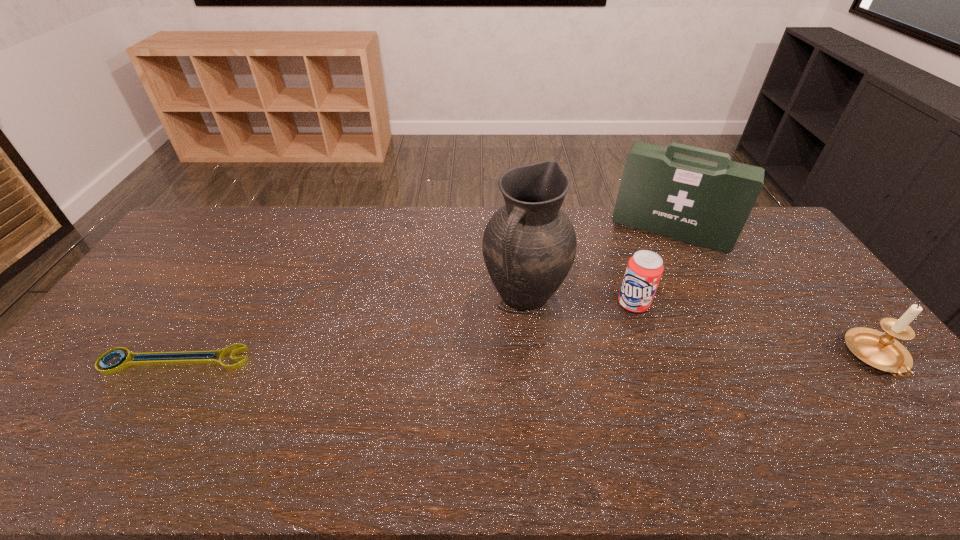
Where is `vacant spot on the desktop that is between the leftmost object and the rightmost object and is positioned on the surface of the soda can`? The height and width of the screenshot is (540, 960). vacant spot on the desktop that is between the leftmost object and the rightmost object and is positioned on the surface of the soda can is located at coordinates (547, 359).

The image size is (960, 540). In order to click on vacant space on the desktop that is between the wrench and the rightmost object and is positioned on the side of the tallest object with the handle in this screenshot , I will do `click(481, 359)`.

Identify the location of free space on the desktop that is between the wrench and the rightmost object and is positioned on the front-facing side of the farthest object. (624, 359).